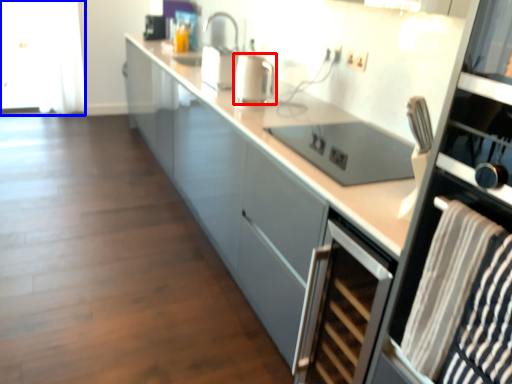
Question: Which point is closer to the camera, kitchen appliance (highlighted by a red box) or glass door (highlighted by a blue box)?

Choices:
 (A) kitchen appliance
 (B) glass door

Answer: (A)